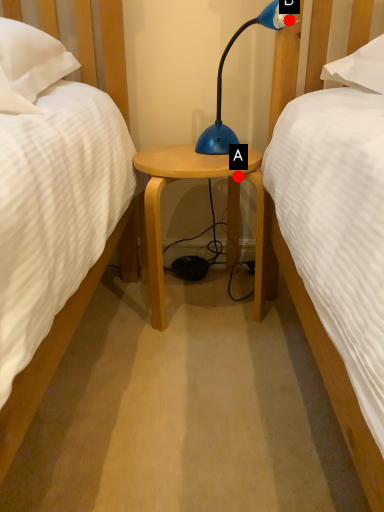
Question: Two points are circled on the image, labeled by A and B beside each circle. Which of the following is the closest to the observer?

Choices:
 (A) A is closer
 (B) B is closer

Answer: (B)